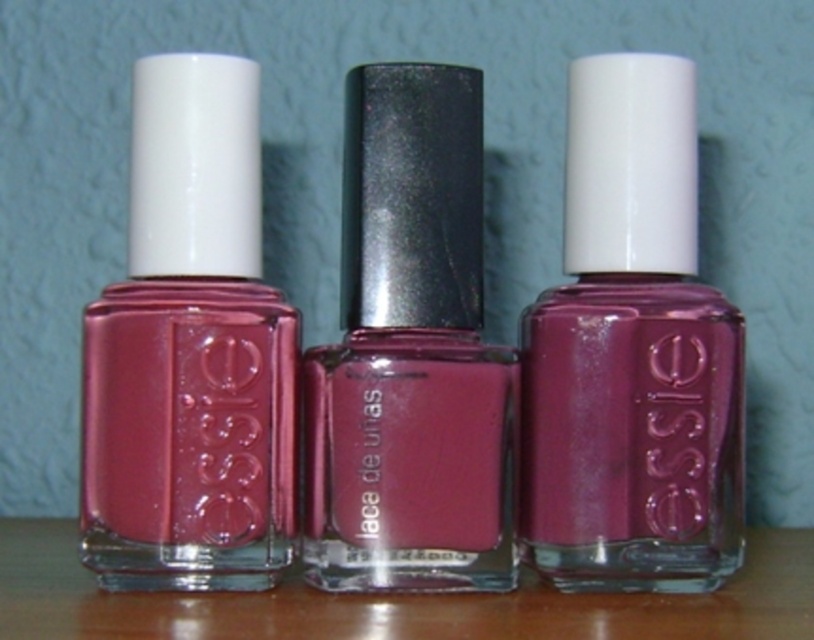
You are trying to place a 3.5 inch wide decorative ribbon between the matte pink nail polish at left and the shiny metallic nail polish at center. Will the ribbon fit between them?

The distance between the matte pink nail polish at left and the shiny metallic nail polish at center is 2.79 inches, which is narrower than the 3.5 inch wide ribbon. The ribbon will not fit between them.